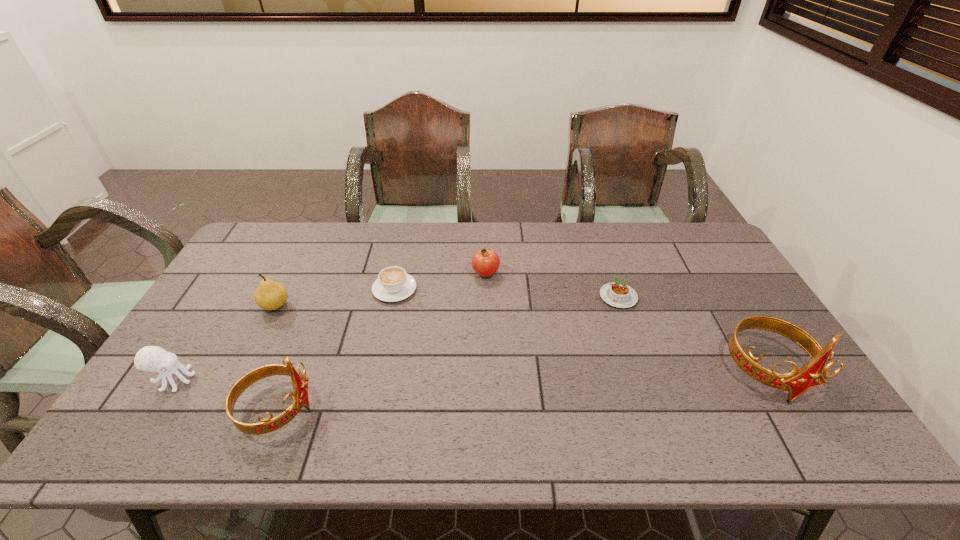
Find the location of a particular element. object that is at the left edge is located at coordinates (149, 358).

You are a GUI agent. You are given a task and a screenshot of the screen. Output one action in this format:
    pyautogui.click(x=<x>, y=<y>)
    Task: Click on the object at the right edge
    This screenshot has width=960, height=540.
    Given the screenshot: What is the action you would take?
    pyautogui.click(x=815, y=372)

Where is `object present at the near left corner`? Image resolution: width=960 pixels, height=540 pixels. object present at the near left corner is located at coordinates (149, 358).

Locate an element on the screen. object that is at the near right corner is located at coordinates pyautogui.click(x=815, y=372).

The width and height of the screenshot is (960, 540). In order to click on free space at the far edge of the desktop in this screenshot , I will do `click(470, 251)`.

At what (x,y) coordinates should I click in order to perform the action: click on vacant area at the near edge of the desktop. Please return your answer as a coordinate pair (x, y). The image size is (960, 540). Looking at the image, I should click on (618, 386).

Locate an element on the screen. The width and height of the screenshot is (960, 540). blank space at the left edge of the desktop is located at coordinates (273, 271).

The height and width of the screenshot is (540, 960). In the image, there is a desktop. In order to click on vacant area at the right edge in this screenshot , I will do `click(780, 347)`.

Locate an element on the screen. vacant area at the far left corner of the desktop is located at coordinates (260, 261).

Find the location of a particular element. This screenshot has width=960, height=540. vacant space at the near left corner of the desktop is located at coordinates click(151, 409).